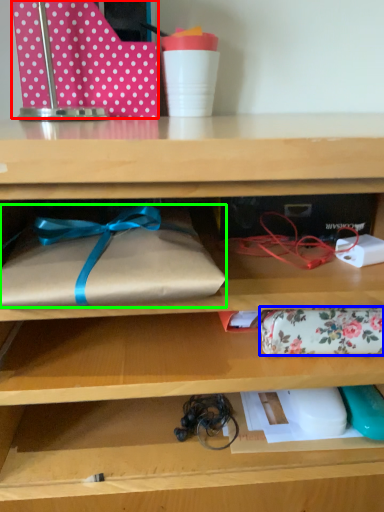
Question: Considering the real-world distances, which object is farthest from wrapping paper (highlighted by a red box)? wrap (highlighted by a blue box) or wrap (highlighted by a green box)?

Choices:
 (A) wrap
 (B) wrap

Answer: (A)